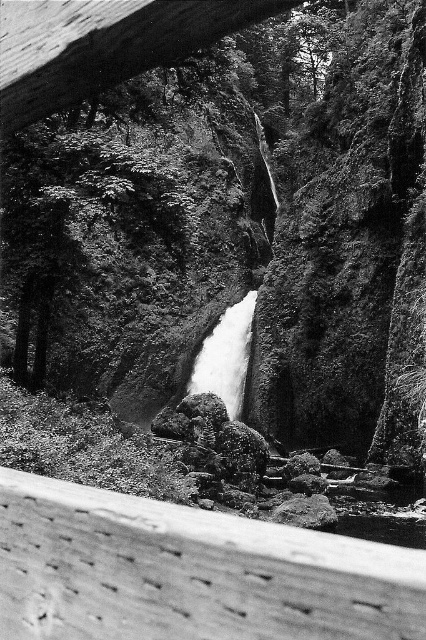
Who is positioned more to the left, smooth wooden beam at lower left or white smooth waterfall at center?

From the viewer's perspective, smooth wooden beam at lower left appears more on the left side.

Find the location of a particular element. smooth wooden beam at lower left is located at coordinates (189, 572).

Does point (62, 38) lie behind point (209, 358)?

That is False.

Where is `wooden beam at upper center`? Image resolution: width=426 pixels, height=640 pixels. wooden beam at upper center is located at coordinates (103, 44).

Does smooth wooden beam at lower left have a smaller size compared to wooden beam at upper center?

No, smooth wooden beam at lower left is not smaller than wooden beam at upper center.

Between smooth wooden beam at lower left and wooden beam at upper center, which one has more height?

wooden beam at upper center is taller.

Between point (170, 579) and point (126, 58), which one is positioned behind?

Positioned behind is point (126, 58).

Image resolution: width=426 pixels, height=640 pixels. Identify the location of smooth wooden beam at lower left. 189,572.